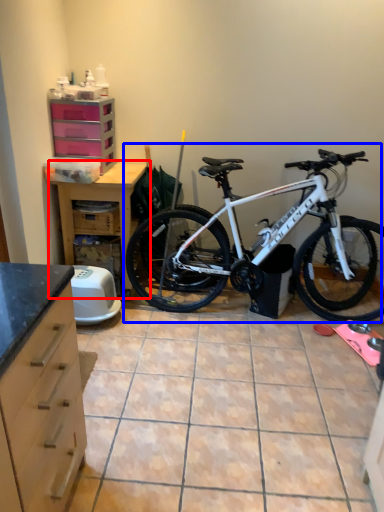
Question: Which of the following is the closest to the observer, table (highlighted by a red box) or bicycle (highlighted by a blue box)?

Choices:
 (A) table
 (B) bicycle

Answer: (B)